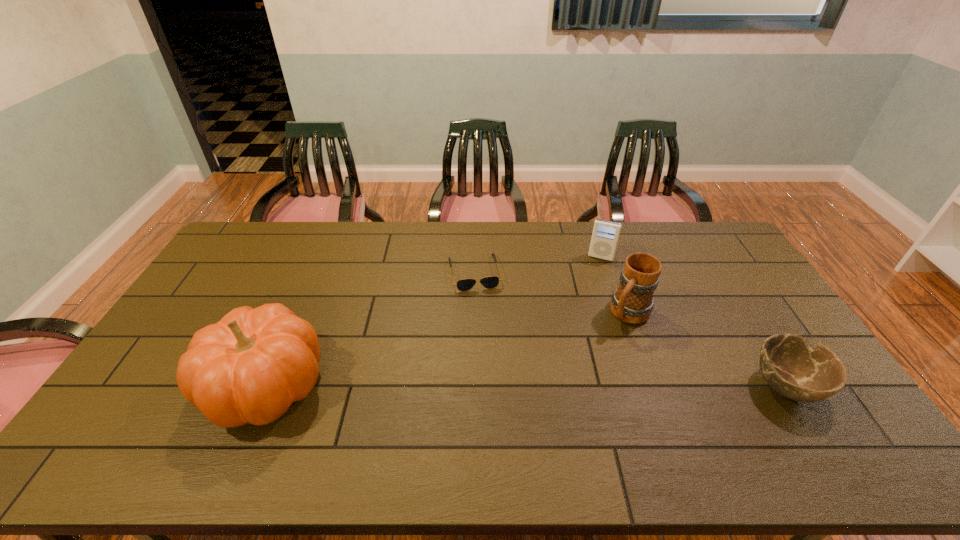
Where is `the tallest object`? the tallest object is located at coordinates (249, 367).

Locate an element on the screen. This screenshot has height=540, width=960. pumpkin is located at coordinates (249, 367).

At what (x,y) coordinates should I click in order to perform the action: click on the second shortest object. Please return your answer as a coordinate pair (x, y). Looking at the image, I should click on (790, 366).

I want to click on bowl, so click(x=790, y=366).

This screenshot has height=540, width=960. Find the location of `the second object from left to right`. the second object from left to right is located at coordinates (490, 282).

In order to click on the shortest object in this screenshot , I will do `click(490, 282)`.

At what (x,y) coordinates should I click in order to perform the action: click on the third tallest object. Please return your answer as a coordinate pair (x, y). Image resolution: width=960 pixels, height=540 pixels. Looking at the image, I should click on (605, 235).

At what (x,y) coordinates should I click in order to perform the action: click on mug. Please return your answer as a coordinate pair (x, y). This screenshot has width=960, height=540. Looking at the image, I should click on (632, 302).

At what (x,y) coordinates should I click in order to perform the action: click on the second tallest object. Please return your answer as a coordinate pair (x, y). Looking at the image, I should click on (632, 302).

Find the location of a particular element. The height and width of the screenshot is (540, 960). vacant space located 0.100m on the back of the pumpkin is located at coordinates (297, 315).